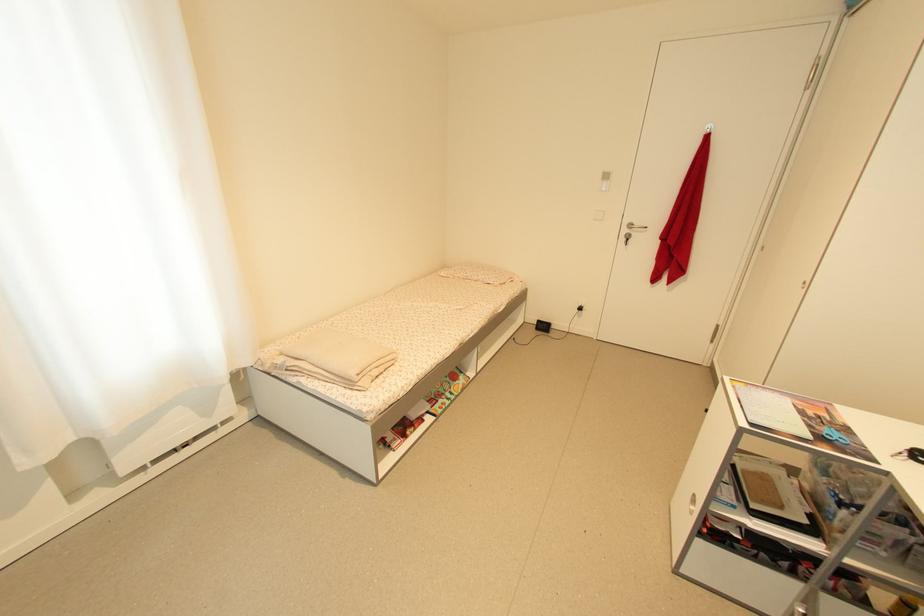
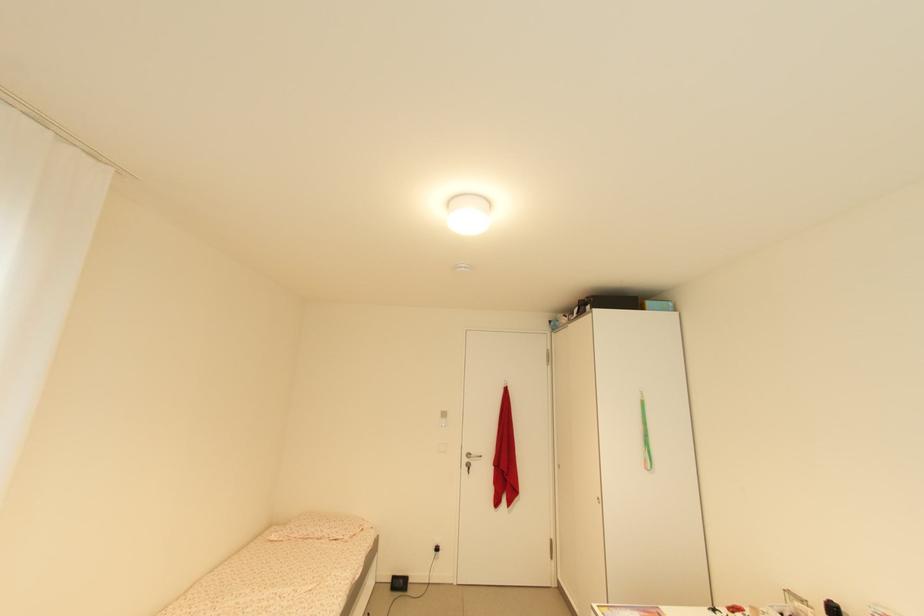
In the second image, find the point that corresponds to (x=485, y=282) in the first image.

(332, 538)